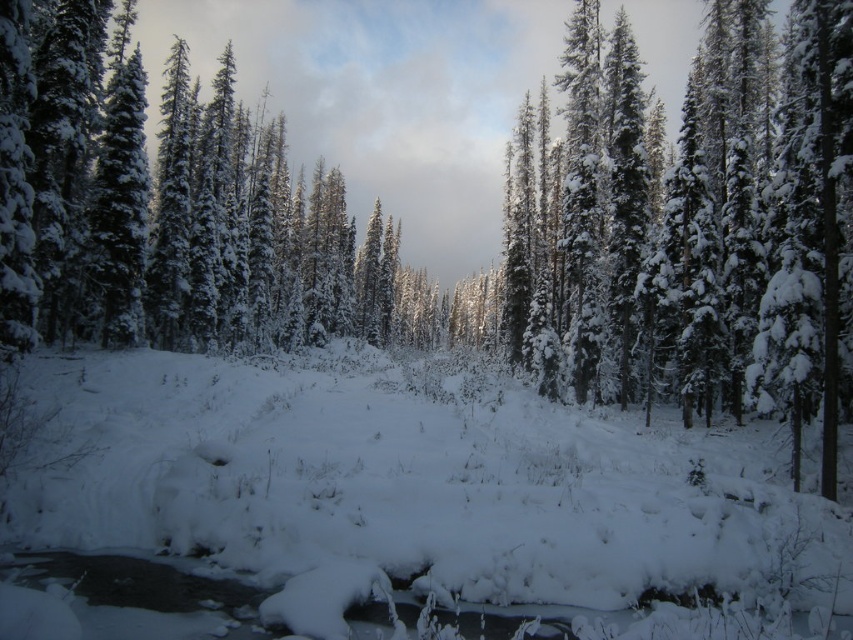
You are a hiker trying to cross the stream in the winter landscape. You notice the white fluffy snow at center and the green matte tree at center. Which one is taller?

The green matte tree at center is taller than the white fluffy snow at center.

You are a hiker who wants to cross the stream safely. You see the white fluffy snow at center and the green matte tree at center. Which object is closer to the stream to help you navigate?

The white fluffy snow at center is closer to the stream than the green matte tree at center, as they are 13.95 meters apart. Since the snow is at the center and the tree is also at the center, but the distance between them indicates the snow is nearer to the stream location.